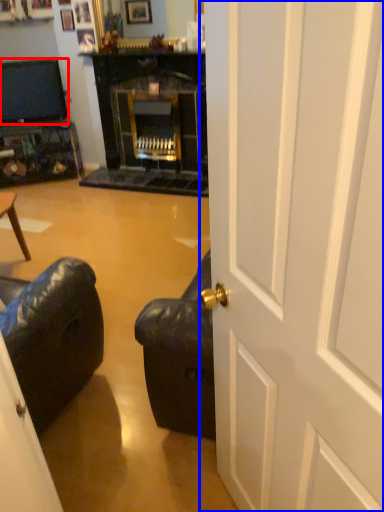
Question: Which point is closer to the camera, television (highlighted by a red box) or door (highlighted by a blue box)?

Choices:
 (A) television
 (B) door

Answer: (B)